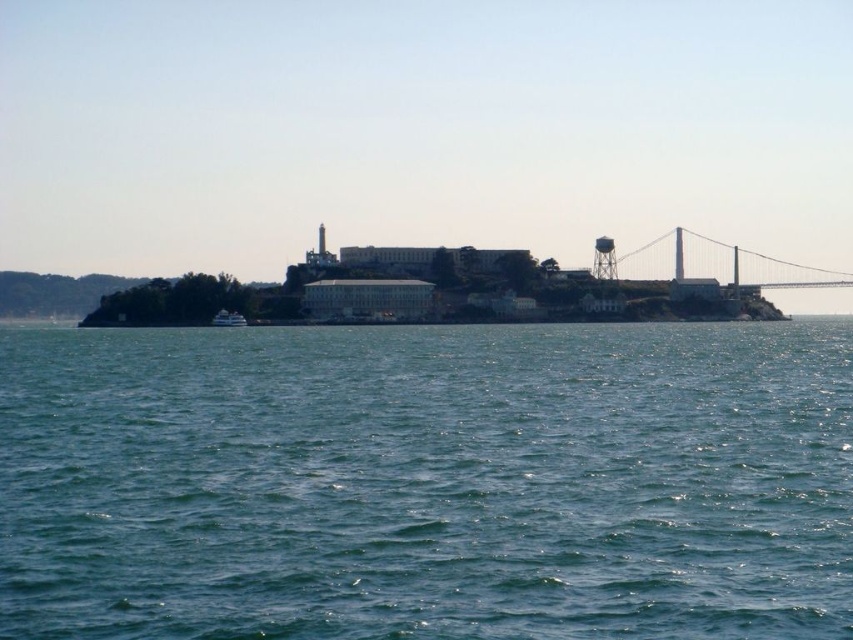
Question: Does blue water at center have a greater width compared to white glossy boat at lower left?

Choices:
 (A) no
 (B) yes

Answer: (B)

Question: Is metallic gray bridge at right above white glossy boat at lower left?

Choices:
 (A) no
 (B) yes

Answer: (B)

Question: Which of the following is the closest to the observer?

Choices:
 (A) metallic gray bridge at right
 (B) white glossy boat at lower left
 (C) blue water at center

Answer: (C)

Question: Which is nearer to the white glossy boat at lower left?

Choices:
 (A) blue water at center
 (B) metallic gray bridge at right

Answer: (A)

Question: Can you confirm if blue water at center is positioned to the right of white glossy boat at lower left?

Choices:
 (A) no
 (B) yes

Answer: (B)

Question: Which point is farther to the camera?

Choices:
 (A) metallic gray bridge at right
 (B) blue water at center

Answer: (A)